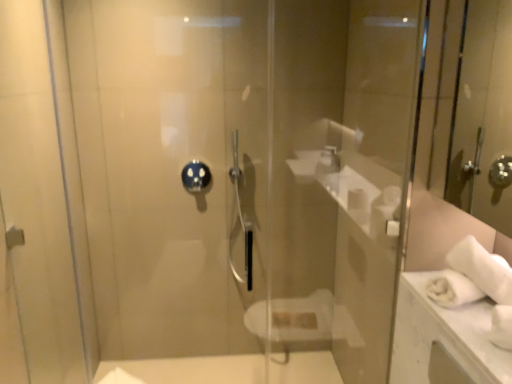
Where is `transparent glass screen door at left`? The width and height of the screenshot is (512, 384). transparent glass screen door at left is located at coordinates (39, 203).

What do you see at coordinates (39, 203) in the screenshot? I see `transparent glass screen door at left` at bounding box center [39, 203].

The image size is (512, 384). I want to click on blue glossy showerhead at center, so click(x=195, y=176).

Where is `transparent glass screen door at left`? Image resolution: width=512 pixels, height=384 pixels. transparent glass screen door at left is located at coordinates (39, 203).

In the image, is transparent glass screen door at left on the left side or the right side of blue glossy showerhead at center?

From the image, it's evident that transparent glass screen door at left is to the left of blue glossy showerhead at center.

Which is closer to the camera, [6,171] or [191,163]?

The point [191,163] is closer.

Is blue glossy showerhead at center located within transparent glass screen door at left?

No, blue glossy showerhead at center is not a part of transparent glass screen door at left.

Which object is further away from the camera taking this photo, transparent glass screen door at left or blue glossy showerhead at center?

blue glossy showerhead at center is more distant.

The width and height of the screenshot is (512, 384). I want to click on glass door that appears below the blue glossy showerhead at center (from the image's perspective), so click(341, 175).

Can transparent glass door at center be found inside blue glossy showerhead at center?

No.

From a real-world perspective, is blue glossy showerhead at center beneath transparent glass door at center?

Indeed, from a real-world perspective, blue glossy showerhead at center is positioned beneath transparent glass door at center.

Which of these two, transparent glass door at center or blue glossy showerhead at center, is bigger?

transparent glass door at center is bigger.

From the image's perspective, would you say transparent glass door at center is positioned over blue glossy showerhead at center?

Actually, transparent glass door at center appears below blue glossy showerhead at center in the image.

Considering the sizes of objects transparent glass door at center and blue glossy showerhead at center in the image provided, who is wider, transparent glass door at center or blue glossy showerhead at center?

transparent glass door at center.

Looking at this image, which object is thinner, transparent glass screen door at left or transparent glass door at center?

With smaller width is transparent glass door at center.

How many degrees apart are the facing directions of transparent glass screen door at left and transparent glass door at center?

transparent glass screen door at left and transparent glass door at center are facing 0.00067 degrees away from each other.

This screenshot has height=384, width=512. I want to click on glass door located behind the transparent glass screen door at left, so 341,175.

Can transparent glass door at center be found inside transparent glass screen door at left?

No.

Looking at this image, would you say blue glossy showerhead at center is inside or outside transparent glass screen door at left?

Result: blue glossy showerhead at center is not enclosed by transparent glass screen door at left.

In the scene shown: Would you say blue glossy showerhead at center is to the left or to the right of transparent glass screen door at left in the picture?

blue glossy showerhead at center is positioned on transparent glass screen door at left's right side.

Who is bigger, blue glossy showerhead at center or transparent glass screen door at left?

transparent glass screen door at left.

Where is `shower on the right of transparent glass screen door at left`? The height and width of the screenshot is (384, 512). shower on the right of transparent glass screen door at left is located at coordinates (195, 176).

Which is more to the left, transparent glass door at center or transparent glass screen door at left?

transparent glass screen door at left is more to the left.

Is transparent glass screen door at left surrounded by transparent glass door at center?

No, transparent glass screen door at left is not a part of transparent glass door at center.

Considering the sizes of objects transparent glass door at center and transparent glass screen door at left in the image provided, who is smaller, transparent glass door at center or transparent glass screen door at left?

transparent glass screen door at left is smaller.

Considering the relative sizes of transparent glass door at center and transparent glass screen door at left in the image provided, is transparent glass door at center taller than transparent glass screen door at left?

Yes, transparent glass door at center is taller than transparent glass screen door at left.

At what (x,y) coordinates should I click in order to perform the action: click on shower to the right of transparent glass screen door at left. Please return your answer as a coordinate pair (x, y). This screenshot has height=384, width=512. Looking at the image, I should click on (195, 176).

Image resolution: width=512 pixels, height=384 pixels. In the image, there is a blue glossy showerhead at center. In order to click on glass door below it (from the image's perspective) in this screenshot , I will do `click(341, 175)`.

Based on their spatial positions, is transparent glass door at center or transparent glass screen door at left further from blue glossy showerhead at center?

transparent glass door at center lies further to blue glossy showerhead at center than the other object.

From the image, which object appears to be farther from blue glossy showerhead at center, transparent glass screen door at left or transparent glass door at center?

transparent glass door at center is further to blue glossy showerhead at center.

From the picture: Considering their positions, is blue glossy showerhead at center positioned closer to transparent glass door at center than transparent glass screen door at left?

blue glossy showerhead at center.

Estimate the real-world distances between objects in this image. Which object is further from transparent glass door at center, transparent glass screen door at left or blue glossy showerhead at center?

transparent glass screen door at left.

Estimate the real-world distances between objects in this image. Which object is further from transparent glass screen door at left, transparent glass door at center or blue glossy showerhead at center?

transparent glass door at center is further to transparent glass screen door at left.

When comparing their distances from transparent glass screen door at left, does blue glossy showerhead at center or transparent glass door at center seem closer?

Based on the image, blue glossy showerhead at center appears to be nearer to transparent glass screen door at left.

Where is `glass door located between transparent glass screen door at left and blue glossy showerhead at center in the depth direction`? glass door located between transparent glass screen door at left and blue glossy showerhead at center in the depth direction is located at coordinates (341, 175).